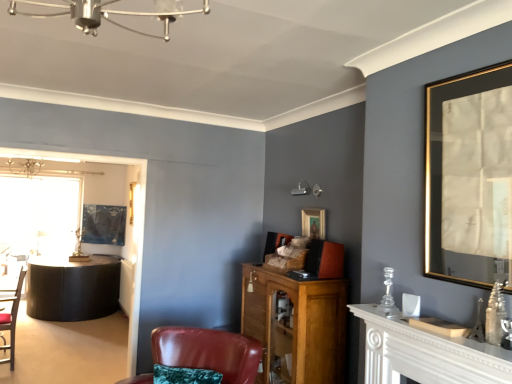
Identify the location of blank space above gold-framed mirror at upper right, the 3th picture frame positioned from the left (from a real-world perspective). (469, 69).